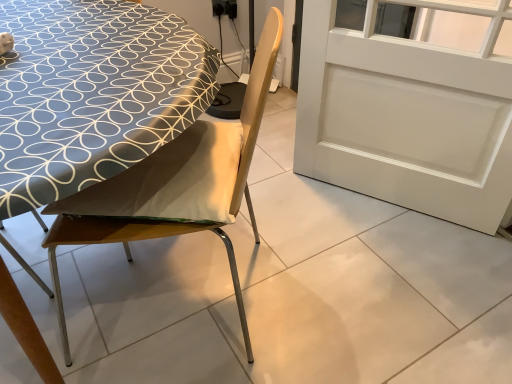
At what (x,y) coordinates should I click in order to perform the action: click on wooden chair at center. Please return your answer as a coordinate pair (x, y). Image resolution: width=512 pixels, height=384 pixels. Looking at the image, I should click on (175, 186).

Describe the element at coordinates (175, 186) in the screenshot. This screenshot has width=512, height=384. I see `wooden chair at center` at that location.

Measure the distance between point (230, 146) and camera.

They are 3.63 feet apart.

Where is `wooden chair at center`? The image size is (512, 384). wooden chair at center is located at coordinates (175, 186).